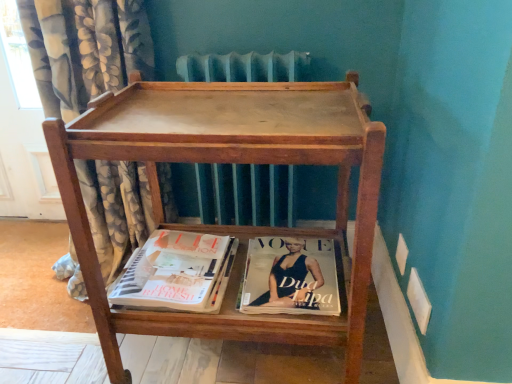
Question: Choose the correct answer: Is floral fabric curtain at left inside matte paper magazine at lower center or outside it?

Choices:
 (A) outside
 (B) inside

Answer: (A)

Question: In terms of width, does floral fabric curtain at left look wider or thinner when compared to matte paper magazine at lower center?

Choices:
 (A) thin
 (B) wide

Answer: (B)

Question: Which object is the farthest from the floral fabric curtain at left?

Choices:
 (A) wooden tray at center
 (B) matte paper magazine at lower center
 (C) matte paper magazine at lower center

Answer: (C)

Question: Based on their relative distances, which object is nearer to the floral fabric curtain at left?

Choices:
 (A) wooden tray at center
 (B) matte paper magazine at lower center
 (C) matte paper magazine at lower center

Answer: (A)